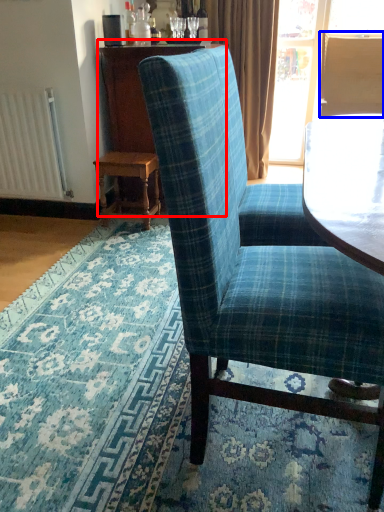
Question: Which object appears farthest to the camera in this image, dresser (highlighted by a red box) or back (highlighted by a blue box)?

Choices:
 (A) dresser
 (B) back

Answer: (B)